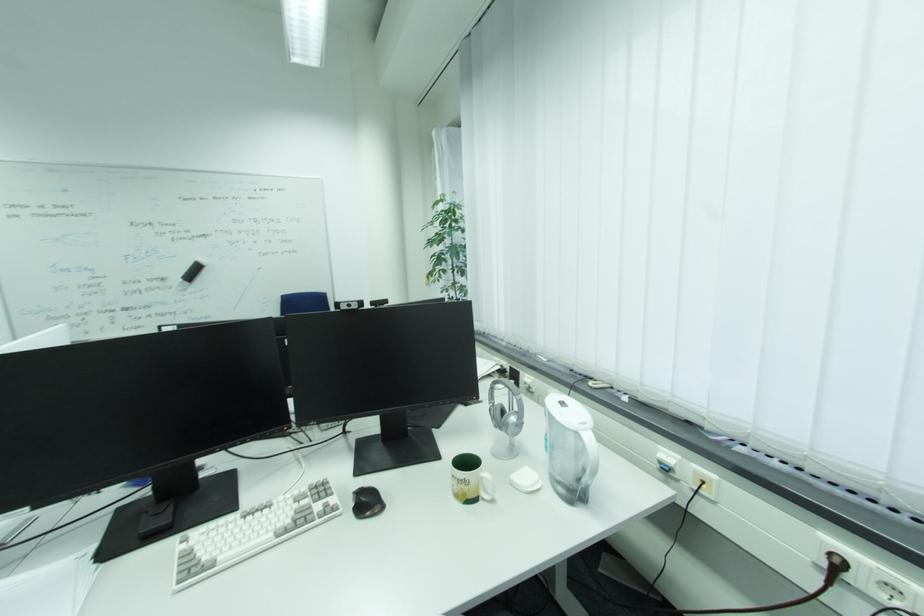
Where is `water pitcher handle`? This screenshot has width=924, height=616. water pitcher handle is located at coordinates (589, 464).